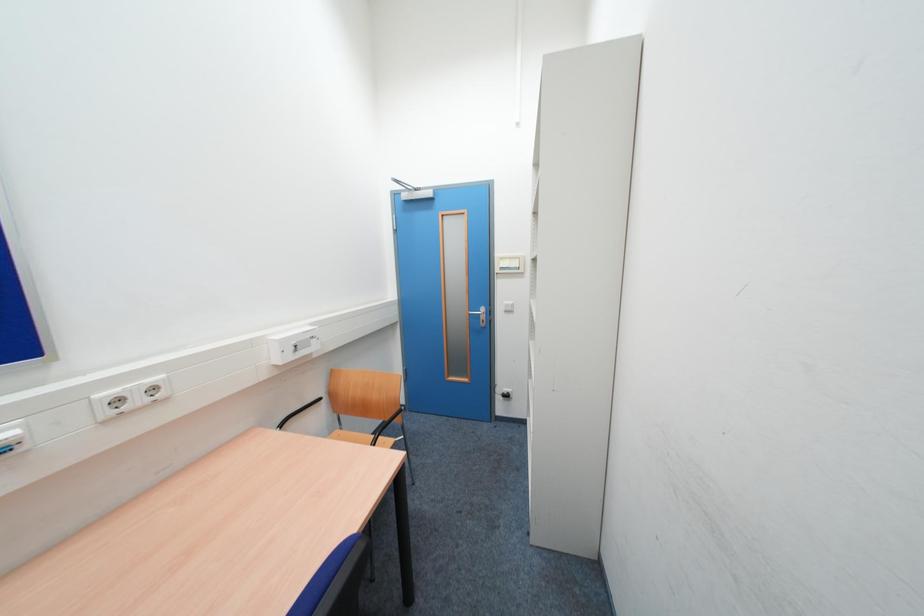
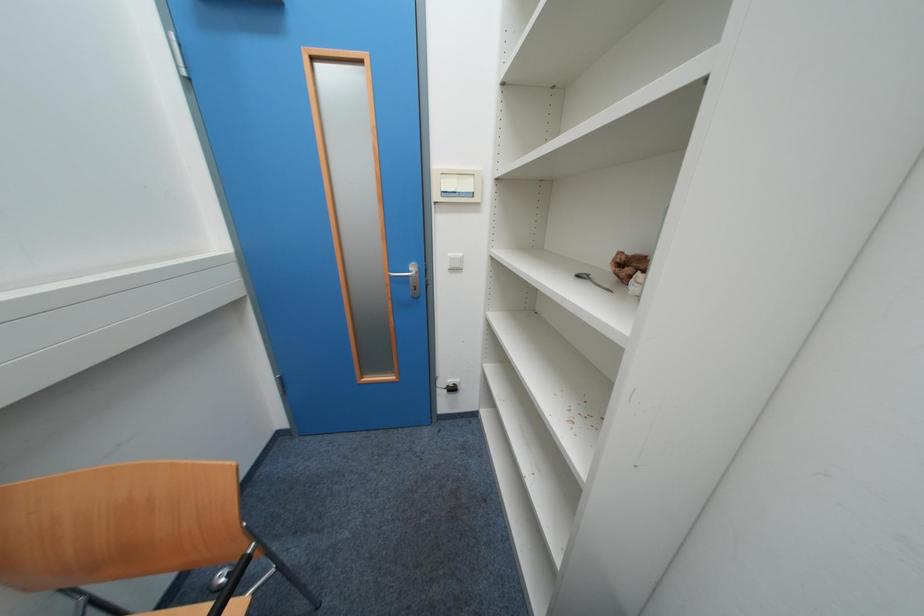
Question: The camera is either moving clockwise (left) or counter-clockwise (right) around the object. The first image is from the beginning of the video and the second image is from the end. Is the camera moving left or right when shooting the video?

Choices:
 (A) Left
 (B) Right

Answer: (A)